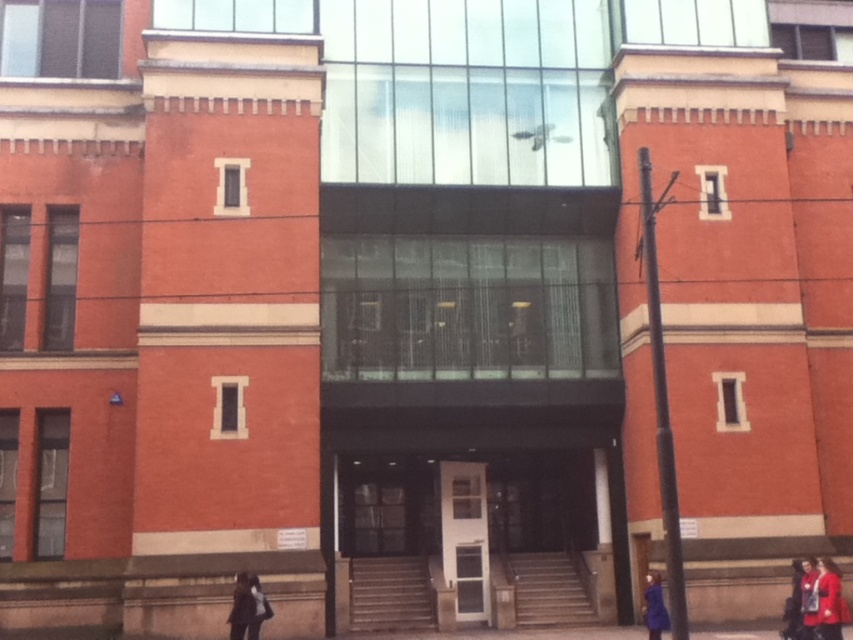
Can you confirm if blue fabric coat at lower right is positioned below red wool coat at lower right?

Actually, blue fabric coat at lower right is above red wool coat at lower right.

The width and height of the screenshot is (853, 640). In order to click on blue fabric coat at lower right in this screenshot , I will do `click(654, 605)`.

What are the coordinates of `blue fabric coat at lower right` in the screenshot? It's located at (654, 605).

Who is positioned more to the left, white glass door at center or red fabric coat at lower right?

Positioned to the left is white glass door at center.

Can you confirm if white glass door at center is smaller than red fabric coat at lower right?

No.

Who is more distant from viewer, [442,524] or [804,588]?

Positioned behind is point [442,524].

Where is `white glass door at center`? white glass door at center is located at coordinates (465, 538).

Based on the photo, which is more to the right, red wool coat at lower right or dark gray fabric jacket at lower left?

red wool coat at lower right

Image resolution: width=853 pixels, height=640 pixels. What do you see at coordinates (793, 605) in the screenshot?
I see `red wool coat at lower right` at bounding box center [793, 605].

Locate an element on the screen. red wool coat at lower right is located at coordinates (793, 605).